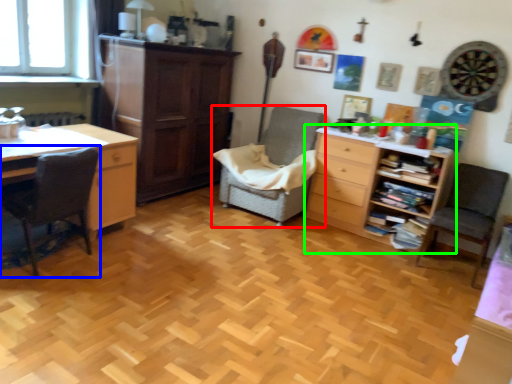
Question: Based on their relative distances, which object is farther from chair (highlighted by a red box)? Choose from chair (highlighted by a blue box) and chest of drawers (highlighted by a green box).

Choices:
 (A) chair
 (B) chest of drawers

Answer: (A)